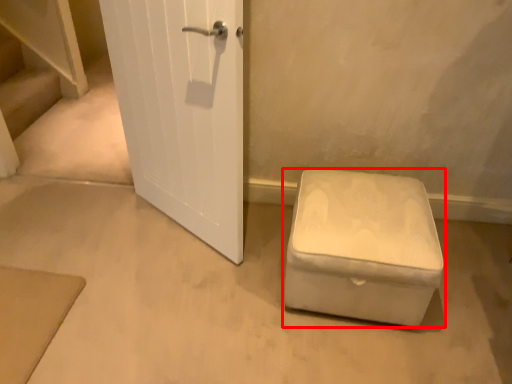
Question: Where is furniture (annotated by the red box) located in relation to stairwell in the image?

Choices:
 (A) left
 (B) right

Answer: (B)